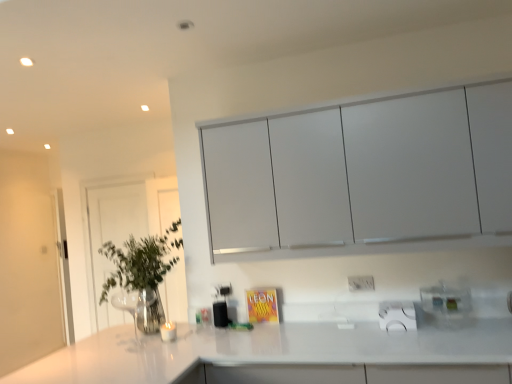
Question: Is white matte cabinet at upper center taller than white glossy countertop at center?

Choices:
 (A) no
 (B) yes

Answer: (B)

Question: Is white matte cabinet at upper center to the left of white glossy countertop at center from the viewer's perspective?

Choices:
 (A) no
 (B) yes

Answer: (A)

Question: Does white matte cabinet at upper center have a lesser height compared to white glossy countertop at center?

Choices:
 (A) yes
 (B) no

Answer: (B)

Question: Is white matte cabinet at upper center to the right of white glossy countertop at center from the viewer's perspective?

Choices:
 (A) no
 (B) yes

Answer: (B)

Question: Is white matte cabinet at upper center closer to the viewer compared to white glossy countertop at center?

Choices:
 (A) yes
 (B) no

Answer: (B)

Question: Is white matte cabinet at upper center not within white glossy countertop at center?

Choices:
 (A) no
 (B) yes

Answer: (B)

Question: Is white glossy countertop at center placed right next to clear glass door at left?

Choices:
 (A) yes
 (B) no

Answer: (B)

Question: Does white glossy countertop at center lie in front of clear glass door at left?

Choices:
 (A) no
 (B) yes

Answer: (B)

Question: Is white glossy countertop at center looking in the opposite direction of clear glass door at left?

Choices:
 (A) yes
 (B) no

Answer: (B)

Question: Considering the relative sizes of white glossy countertop at center and clear glass door at left in the image provided, is white glossy countertop at center thinner than clear glass door at left?

Choices:
 (A) no
 (B) yes

Answer: (A)

Question: Considering the relative positions of white glossy countertop at center and clear glass door at left in the image provided, is white glossy countertop at center to the left of clear glass door at left from the viewer's perspective?

Choices:
 (A) no
 (B) yes

Answer: (A)

Question: Does white glossy countertop at center have a greater height compared to clear glass door at left?

Choices:
 (A) yes
 (B) no

Answer: (B)

Question: Is white plastic electric outlet at center positioned before white matte cabinet at upper center?

Choices:
 (A) no
 (B) yes

Answer: (A)